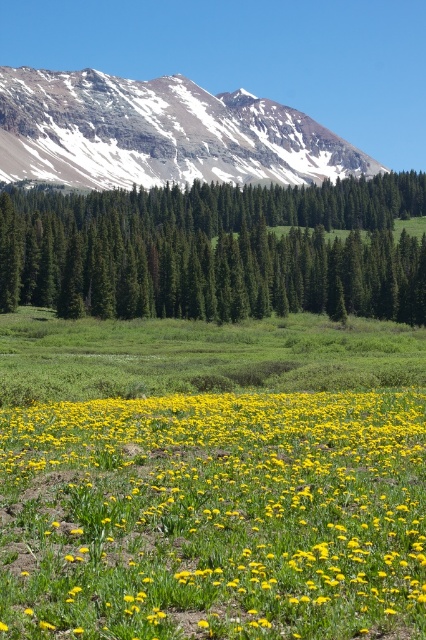
Who is positioned more to the left, yellow matte flower at center or green matte tree at center?

yellow matte flower at center

Between point (417, 499) and point (226, 232), which one is positioned behind?

The point (226, 232) is behind.

The width and height of the screenshot is (426, 640). I want to click on yellow matte flower at center, so click(x=213, y=516).

Is yellow matte flower at center to the right of snowy rocky mountain at upper left from the viewer's perspective?

Yes, yellow matte flower at center is to the right of snowy rocky mountain at upper left.

Between point (169, 515) and point (164, 147), which one is positioned behind?

Point (164, 147)

At what (x,y) coordinates should I click in order to perform the action: click on yellow matte flower at center. Please return your answer as a coordinate pair (x, y). The image size is (426, 640). Looking at the image, I should click on (213, 516).

Is green matte tree at center above snowy rocky mountain at upper left?

No.

Consider the image. Which is below, green matte tree at center or snowy rocky mountain at upper left?

green matte tree at center is lower down.

The width and height of the screenshot is (426, 640). What do you see at coordinates (215, 250) in the screenshot? I see `green matte tree at center` at bounding box center [215, 250].

Where is `green matte tree at center`? This screenshot has width=426, height=640. green matte tree at center is located at coordinates (215, 250).